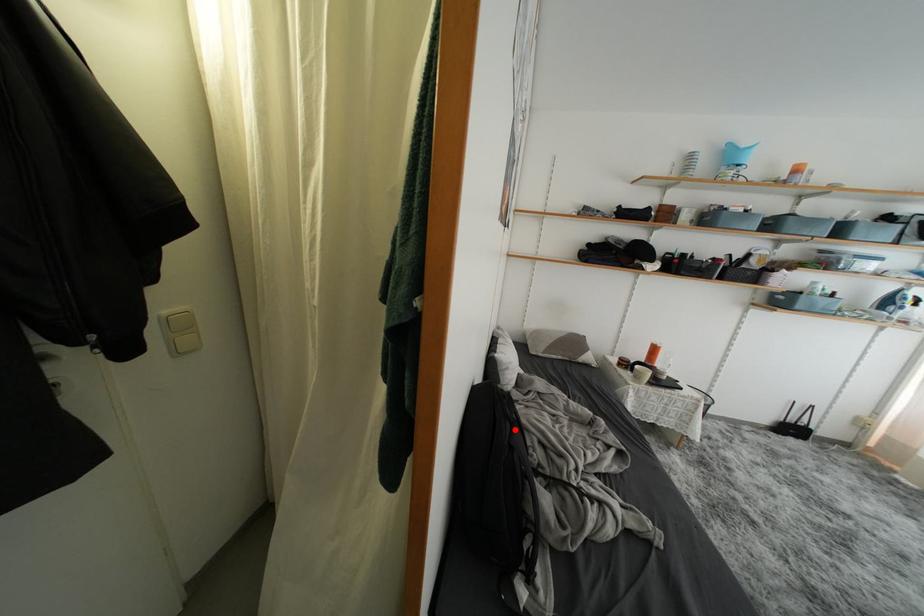
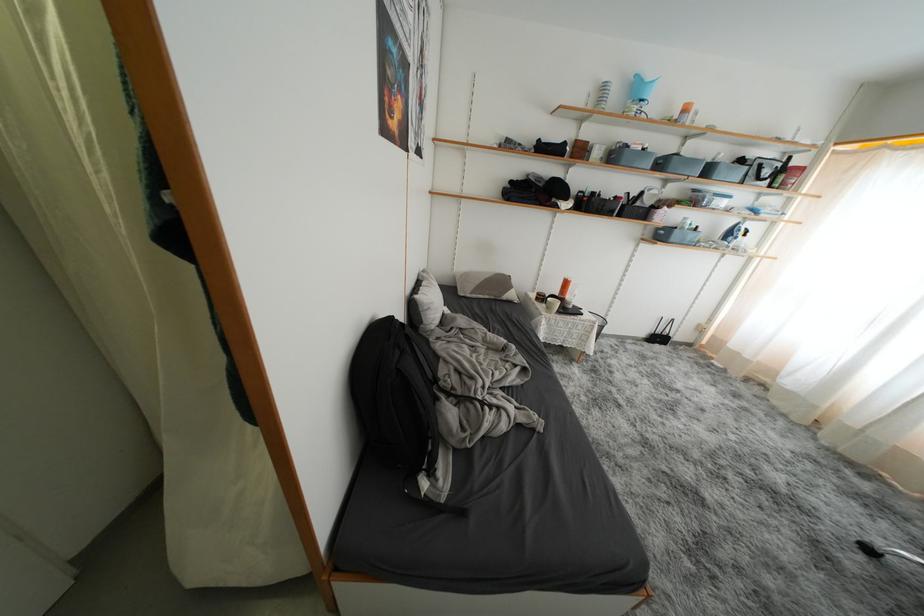
Question: I am providing you with two images of the same scene from different viewpoints. Given a red point in image1, look at the same physical point in image2. Is it:

Choices:
 (A) Closer to the viewpoint
 (B) Farther from the viewpoint

Answer: (A)